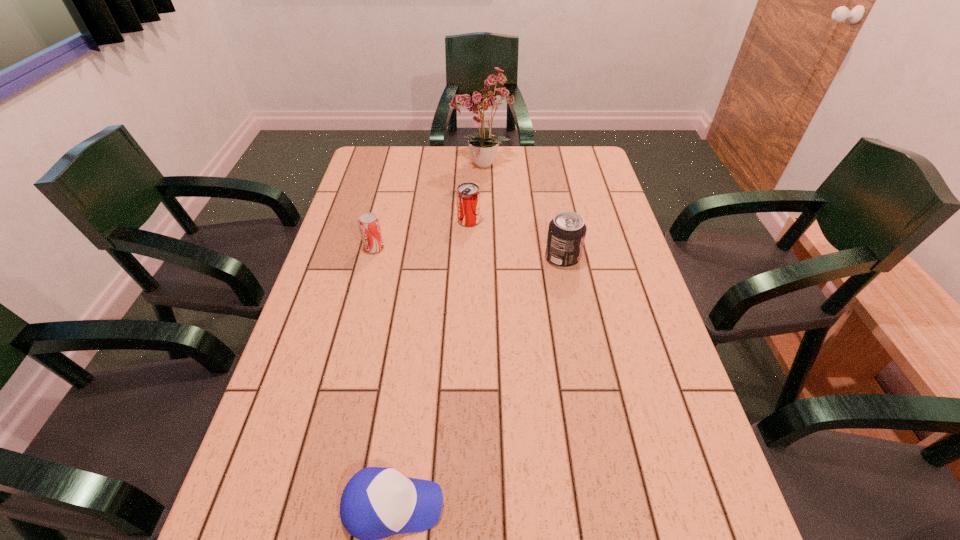
Where is `vacant space situated 0.100m on the right of the fourth nearest object`? This screenshot has width=960, height=540. vacant space situated 0.100m on the right of the fourth nearest object is located at coordinates (512, 221).

The width and height of the screenshot is (960, 540). In order to click on vacant space located 0.080m on the logo side of the leftmost soda can in this screenshot , I will do `click(411, 248)`.

Where is `object that is positioned at the far edge`? object that is positioned at the far edge is located at coordinates (484, 101).

Find the location of a particular element. object present at the left edge is located at coordinates (369, 225).

This screenshot has width=960, height=540. I want to click on object situated at the right edge, so click(x=566, y=234).

The image size is (960, 540). In the image, there is a desktop. Find the location of `vacant area at the far edge`. vacant area at the far edge is located at coordinates (461, 169).

Identify the location of vacant space at the left edge of the desktop. (372, 297).

At what (x,y) coordinates should I click in order to perform the action: click on vacant space at the right edge of the desktop. Please return your answer as a coordinate pair (x, y). This screenshot has height=540, width=960. Looking at the image, I should click on (639, 346).

This screenshot has width=960, height=540. What are the coordinates of `free space at the far left corner of the desktop` in the screenshot? It's located at (385, 152).

Locate an element on the screen. This screenshot has height=540, width=960. free area in between the leftmost soda can and the fourth nearest object is located at coordinates (x=421, y=234).